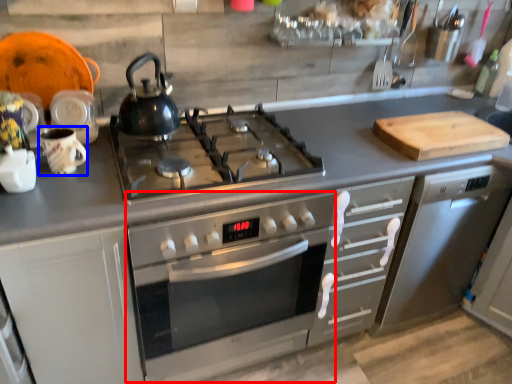
Question: Which object appears closest to the camera in this image, oven (highlighted by a red box) or mug (highlighted by a blue box)?

Choices:
 (A) oven
 (B) mug

Answer: (A)